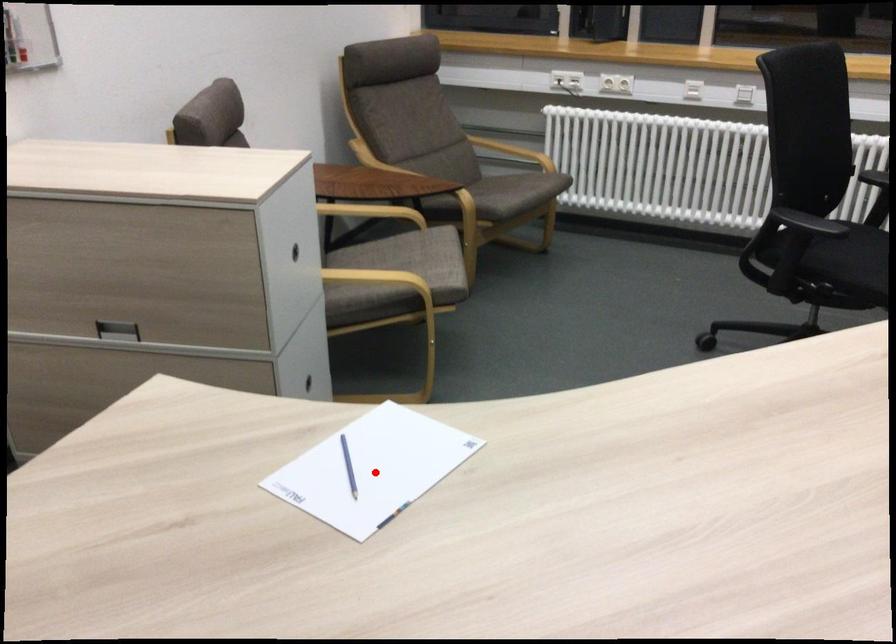
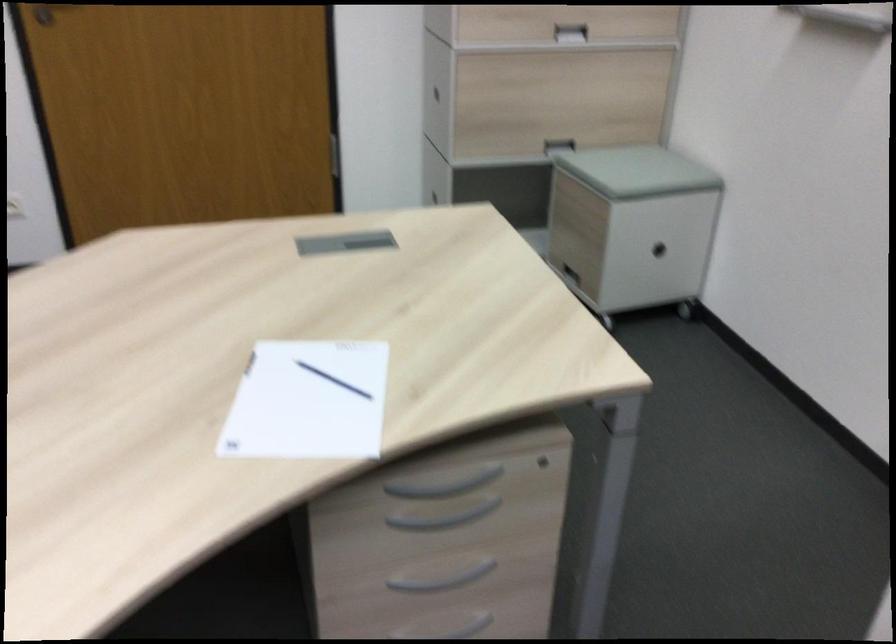
Question: I am providing you with two images of the same scene from different viewpoints. A red point is marked on the first image. Is the red point's position out of view in image 2?

Choices:
 (A) Yes
 (B) No

Answer: (B)